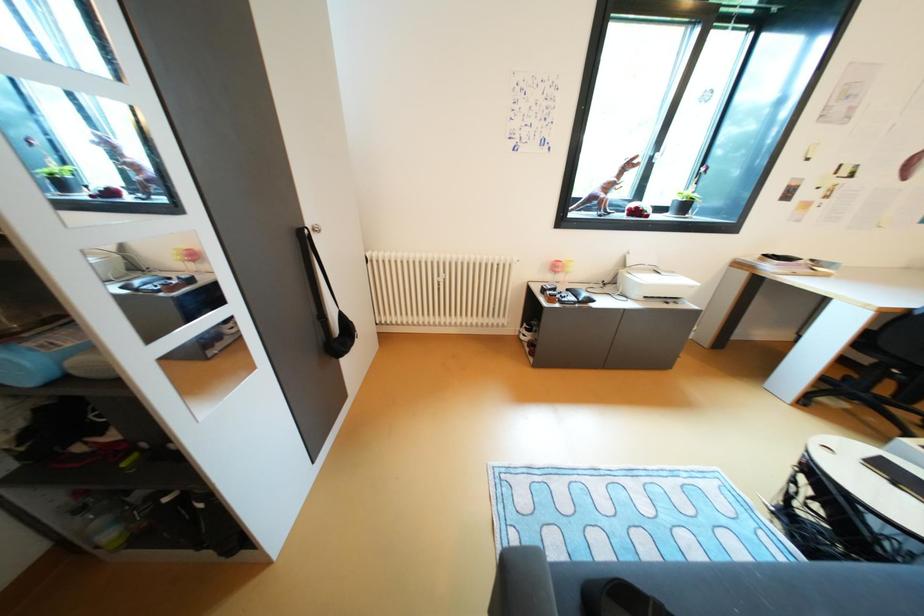
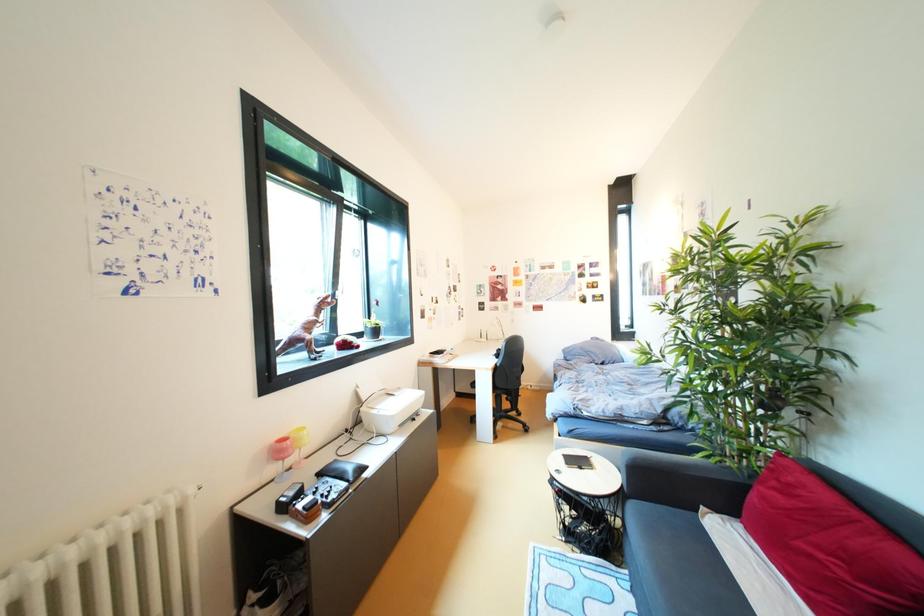
Question: The images are taken continuously from a first-person perspective. In which direction is your viewpoint rotating?

Choices:
 (A) Left
 (B) Right
 (C) Up
 (D) Down

Answer: (B)